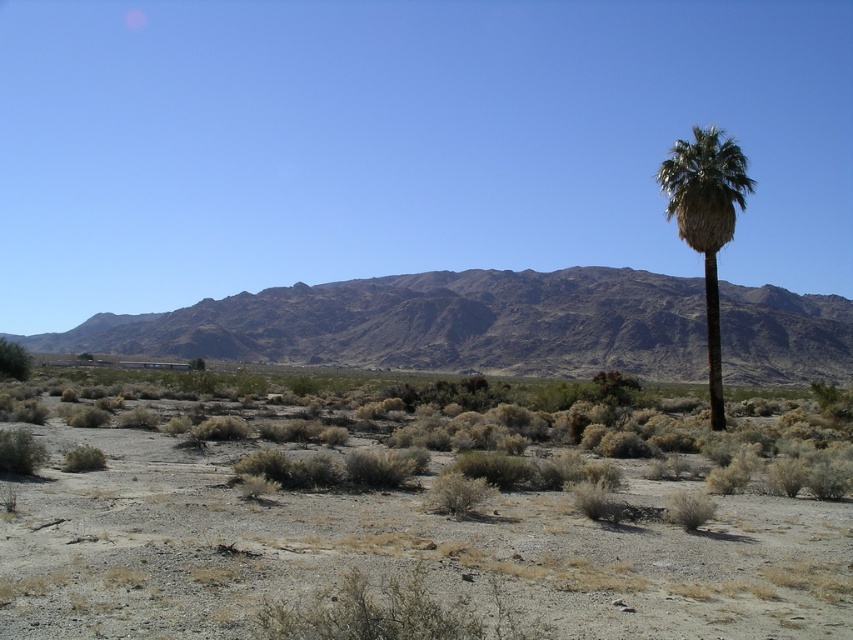
Who is taller, dry shrubbery at center or green leafy palm at right?

Standing taller between the two is green leafy palm at right.

Is point (286, 374) in front of point (703, 214)?

No.

I want to click on dry shrubbery at center, so click(416, 508).

Can you confirm if dark brown rocky mountain range at center is shorter than green leafy bush at lower left?

No, dark brown rocky mountain range at center is not shorter than green leafy bush at lower left.

This screenshot has height=640, width=853. Describe the element at coordinates (431, 323) in the screenshot. I see `dark brown rocky mountain range at center` at that location.

Where is `dark brown rocky mountain range at center`? The image size is (853, 640). dark brown rocky mountain range at center is located at coordinates (431, 323).

Does dry shrubbery at center have a greater height compared to dark brown rocky mountain range at center?

No, dry shrubbery at center is not taller than dark brown rocky mountain range at center.

Is dry shrubbery at center wider than dark brown rocky mountain range at center?

No, dry shrubbery at center is not wider than dark brown rocky mountain range at center.

Locate an element on the screen. The width and height of the screenshot is (853, 640). dry shrubbery at center is located at coordinates (416, 508).

Find the location of a particular element. dry shrubbery at center is located at coordinates (416, 508).